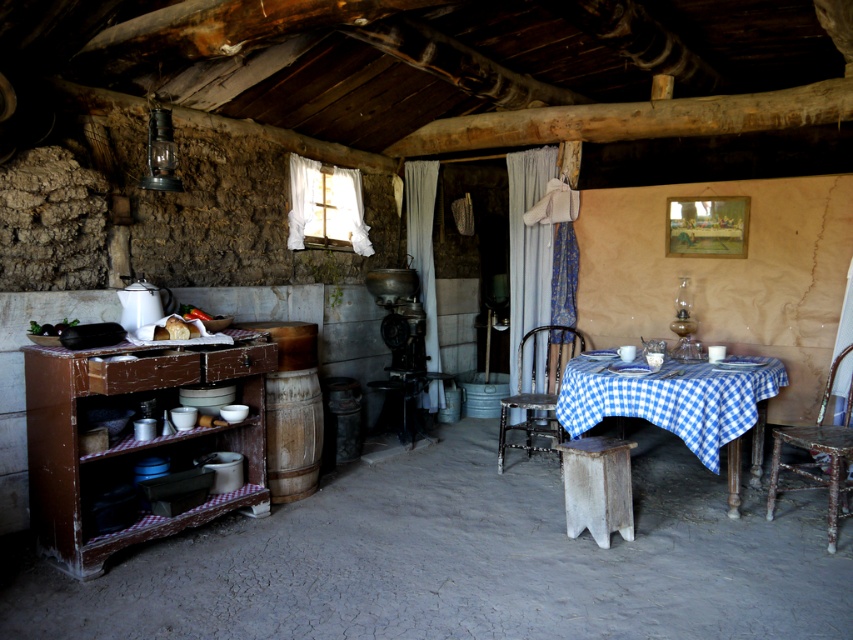
Question: Is wooden table at left wider than wooden stool at center?

Choices:
 (A) yes
 (B) no

Answer: (A)

Question: Estimate the real-world distances between objects in this image. Which object is farther from the wooden table at left?

Choices:
 (A) blue checkered tablecloth at center
 (B) wooden stool at center
 (C) rusty metal chair at center
 (D) wooden chair at center

Answer: (D)

Question: Which object appears closest to the camera in this image?

Choices:
 (A) wooden table at left
 (B) wooden stool at center
 (C) wooden chair at center
 (D) rusty metal chair at center

Answer: (A)

Question: Is wooden table at left thinner than rusty metal chair at center?

Choices:
 (A) no
 (B) yes

Answer: (A)

Question: Is wooden table at left to the right of wooden stool at center from the viewer's perspective?

Choices:
 (A) no
 (B) yes

Answer: (A)

Question: Which object appears farthest from the camera in this image?

Choices:
 (A) wooden stool at center
 (B) blue checkered tablecloth at center
 (C) rusty metal chair at center

Answer: (C)